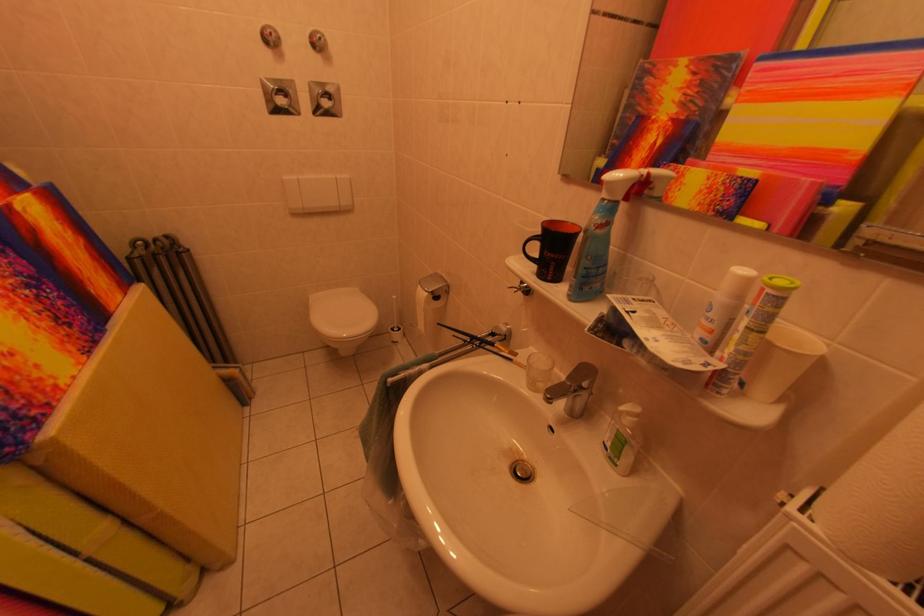
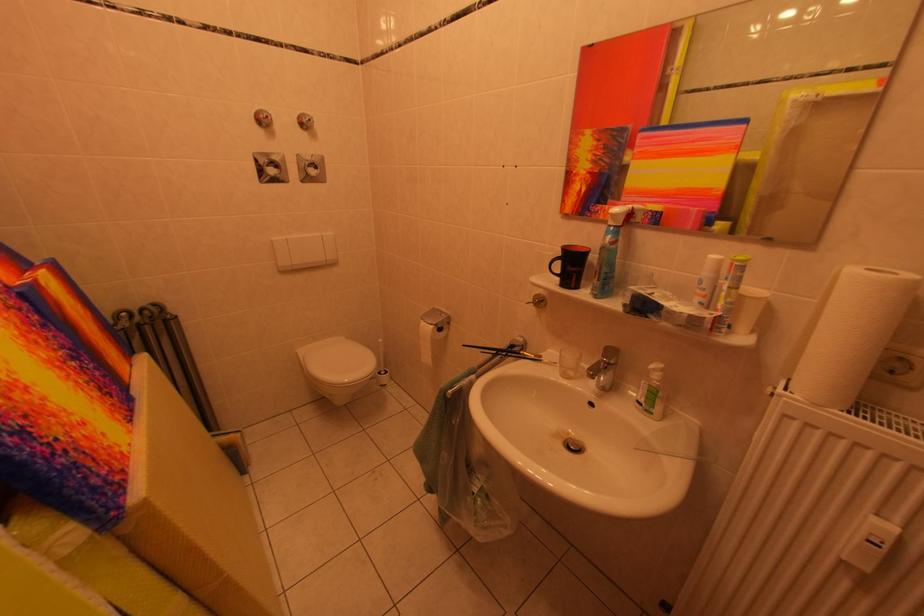
In the second image, find the point that corresponds to (x=590, y=275) in the first image.

(613, 280)